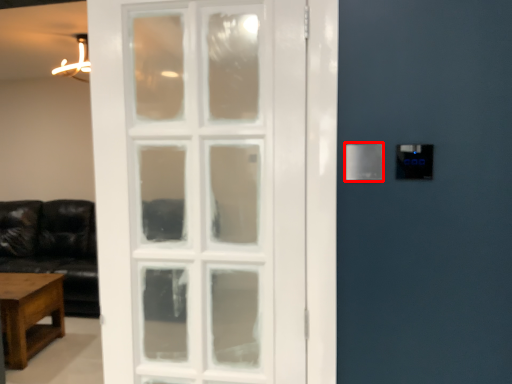
Question: From the image's perspective, where is light switch (annotated by the red box) located relative to table?

Choices:
 (A) below
 (B) above

Answer: (B)